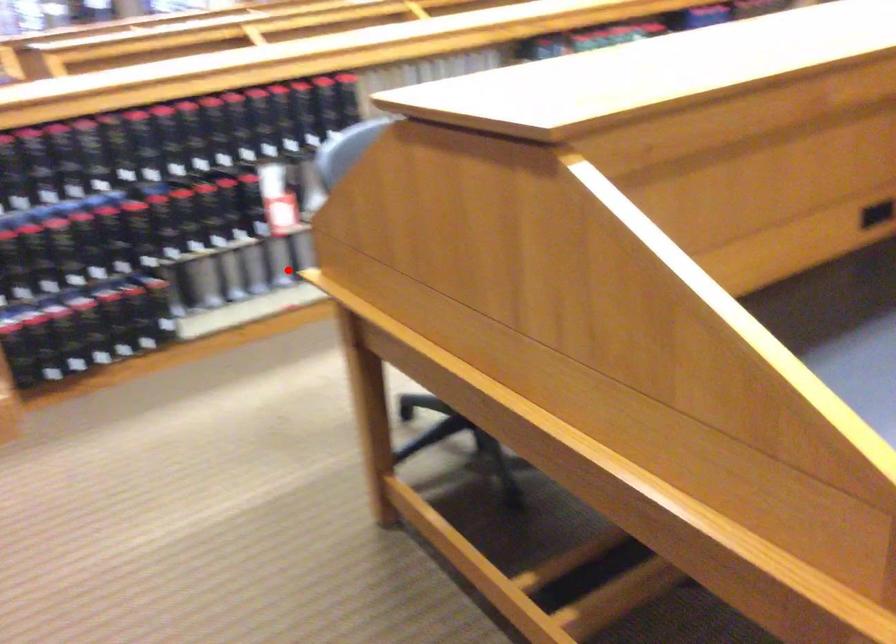
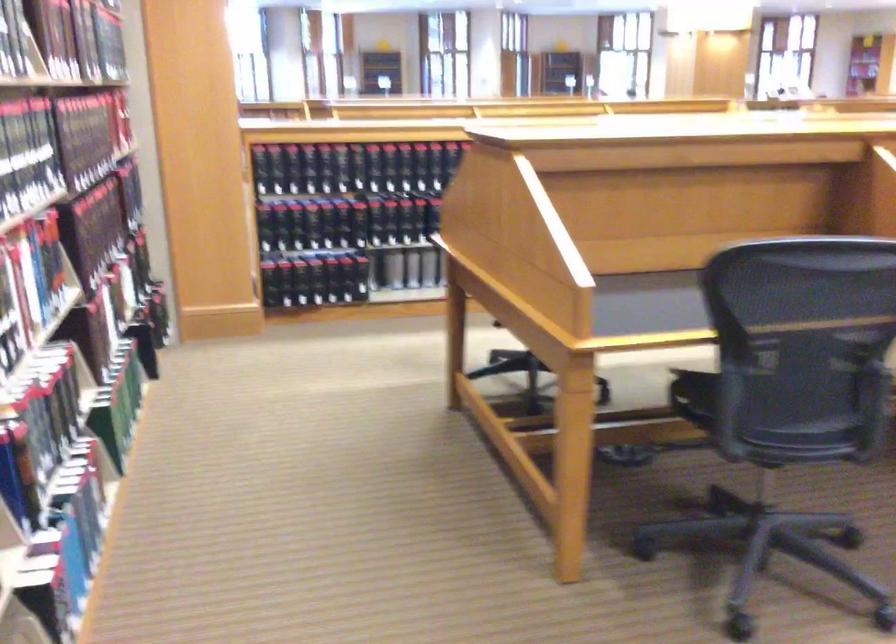
Question: I am providing you with two images of the same scene from different viewpoints. A red point is marked on the first image. Can you still see the location of the red point in image 2?

Choices:
 (A) Yes
 (B) No

Answer: (B)